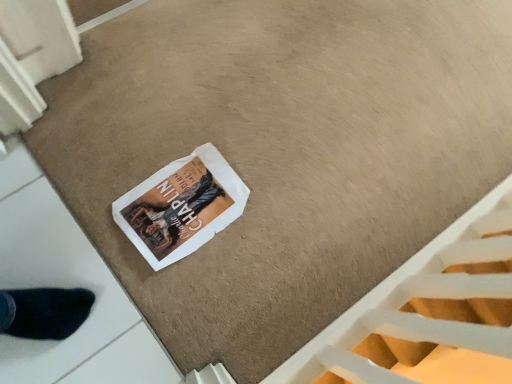
This screenshot has width=512, height=384. What are the coordinates of `free point above white paper magazine at center (from a real-world perspective)` in the screenshot? It's located at (185, 207).